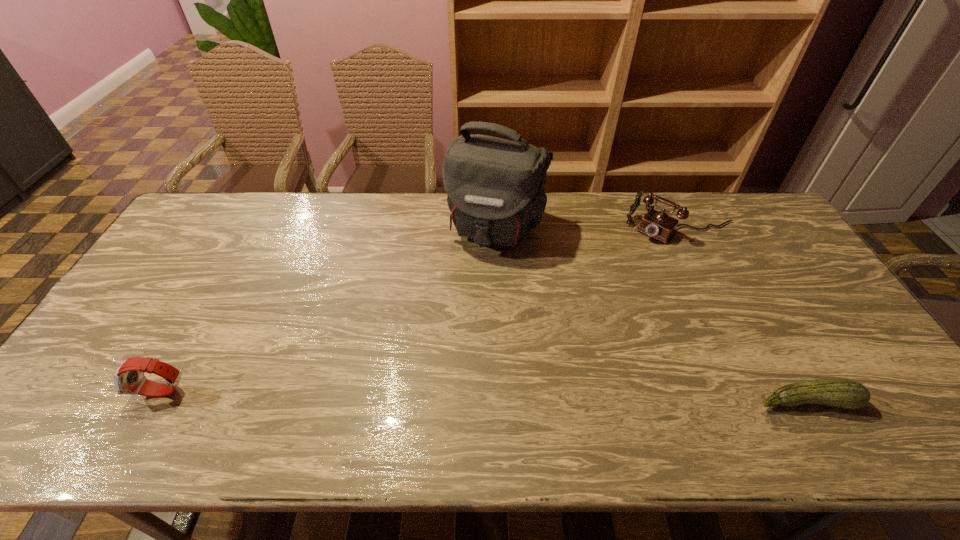
Identify the location of blank area at the far edge. The width and height of the screenshot is (960, 540). (572, 200).

Find the location of `free space at the near edge`. free space at the near edge is located at coordinates (572, 397).

In the image, there is a desktop. Where is `free region at the left edge`? The image size is (960, 540). free region at the left edge is located at coordinates [163, 297].

Where is `vacant region at the right edge`? vacant region at the right edge is located at coordinates (788, 316).

Identify the location of free space at the far left corner of the desktop. (233, 192).

I want to click on blank space at the far right corner of the desktop, so click(x=758, y=210).

Find the location of a particular element. free space between the shortest object and the watch is located at coordinates (485, 396).

The image size is (960, 540). Identify the location of vacant area that lies between the watch and the zucchini. (485, 396).

Identify the location of free space between the shoulder bag and the telephone. This screenshot has width=960, height=540. 589,229.

Where is `free space between the shortest object and the telephone`? Image resolution: width=960 pixels, height=540 pixels. free space between the shortest object and the telephone is located at coordinates (744, 315).